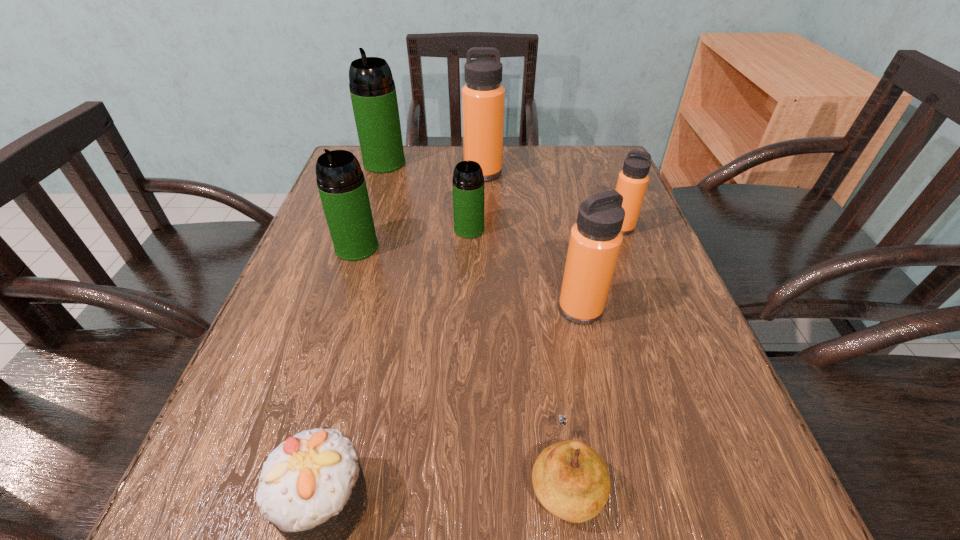
Where is `free spot between the biggest orange thermos bottle and the rightmost object`? free spot between the biggest orange thermos bottle and the rightmost object is located at coordinates (552, 200).

Point out which object is positioned as the second nearest to the biggest green thermos bottle. Please provide its 2D coordinates. Your answer should be formatted as a tuple, i.e. [(x, y)], where the tuple contains the x and y coordinates of a point satisfying the conditions above.

[(468, 182)]

Identify which object is the closest to the third nearest object. Please provide its 2D coordinates. Your answer should be formatted as a tuple, i.e. [(x, y)], where the tuple contains the x and y coordinates of a point satisfying the conditions above.

[(632, 182)]

I want to click on thermos bottle object that ranks as the fourth closest to the pear, so click(632, 182).

Image resolution: width=960 pixels, height=540 pixels. What are the coordinates of `thermos bottle that is the closest to the rightmost green thermos bottle` in the screenshot? It's located at (341, 183).

Identify the location of the closest green thermos bottle to the cupcake. The image size is (960, 540). (341, 183).

Locate which green thermos bottle is the closest to the second farthest orange thermos bottle. Please provide its 2D coordinates. Your answer should be formatted as a tuple, i.e. [(x, y)], where the tuple contains the x and y coordinates of a point satisfying the conditions above.

[(468, 182)]

Select which orange thermos bottle is the closest to the biggest green thermos bottle. Please provide its 2D coordinates. Your answer should be formatted as a tuple, i.e. [(x, y)], where the tuple contains the x and y coordinates of a point satisfying the conditions above.

[(483, 96)]

Select which orange thermos bottle appears as the third closest to the biggest green thermos bottle. Please provide its 2D coordinates. Your answer should be formatted as a tuple, i.e. [(x, y)], where the tuple contains the x and y coordinates of a point satisfying the conditions above.

[(596, 238)]

Find the location of a particular element. Image resolution: width=960 pixels, height=540 pixels. vacant space that satisfies the following two spatial constraints: 1. from the spout of the smallest green thermos bottle; 2. on the left side of the pear is located at coordinates (462, 479).